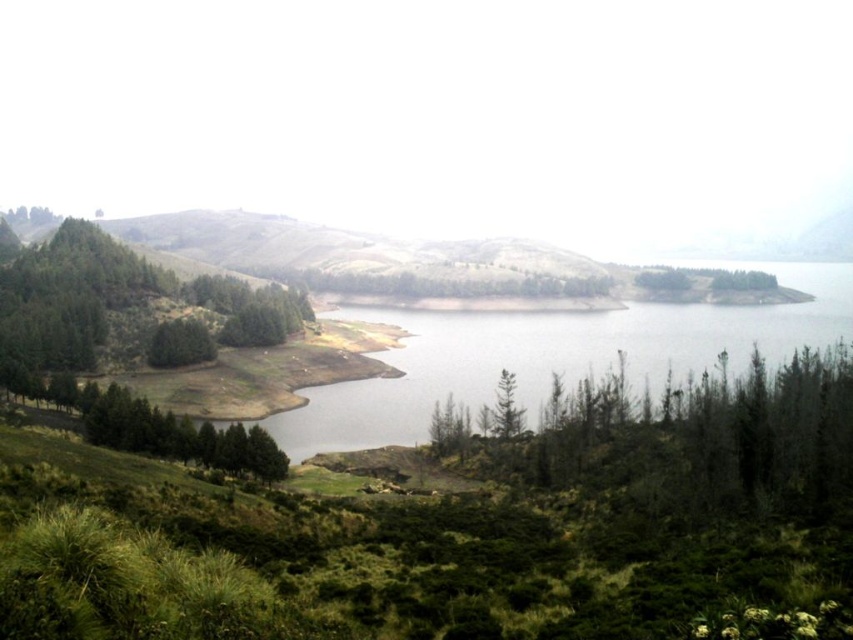
Which is in front, point (274, 433) or point (44, 362)?

Positioned in front is point (274, 433).

Does clear water at center have a smaller size compared to green leafy trees at left?

Incorrect, clear water at center is not smaller in size than green leafy trees at left.

Locate an element on the screen. clear water at center is located at coordinates point(554,355).

In order to click on clear water at center in this screenshot , I will do `click(554, 355)`.

Can you confirm if clear water at center is positioned below green leafy tree at center?

Answer: No, clear water at center is not below green leafy tree at center.

Between clear water at center and green leafy tree at center, which one appears on the left side from the viewer's perspective?

From the viewer's perspective, green leafy tree at center appears more on the left side.

Does point (347, 440) come farther from viewer compared to point (500, 408)?

Yes.

Image resolution: width=853 pixels, height=640 pixels. In order to click on clear water at center in this screenshot , I will do `click(554, 355)`.

Between green matte trees at center and clear water at center, which one has more height?

clear water at center is taller.

What do you see at coordinates (688, 444) in the screenshot?
I see `green matte trees at center` at bounding box center [688, 444].

Which is in front, point (778, 484) or point (308, 436)?

Positioned in front is point (778, 484).

At what (x,y) coordinates should I click in order to perform the action: click on green matte trees at center. Please return your answer as a coordinate pair (x, y). This screenshot has width=853, height=640. Looking at the image, I should click on (688, 444).